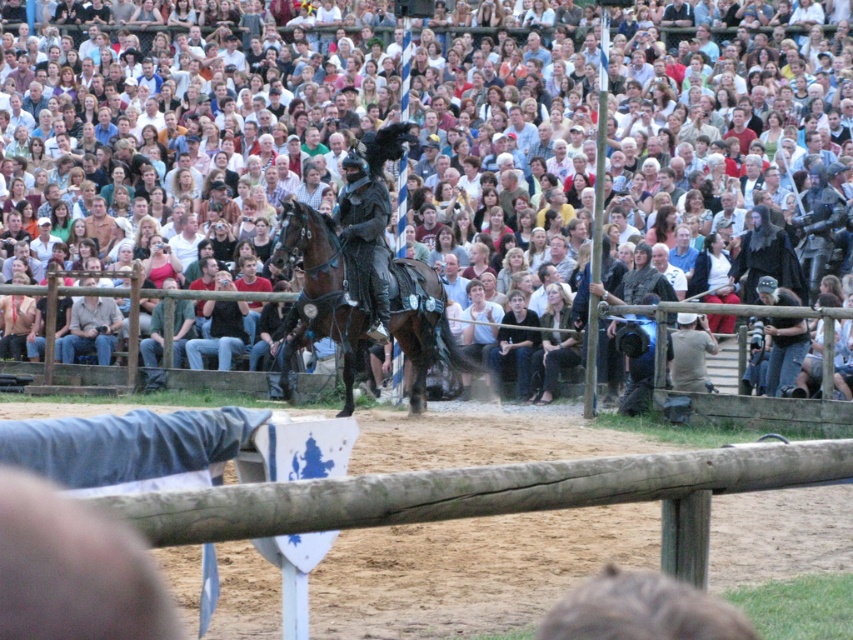
Question: Where is dark gray fabric at lower center located in relation to dark blue jeans at lower center in the image?

Choices:
 (A) left
 (B) right

Answer: (B)

Question: Which point is closer to the camera taking this photo?

Choices:
 (A) (519, 394)
 (B) (554, 340)

Answer: (A)

Question: Estimate the real-world distances between objects in this image. Which object is closer to the wooden at center?

Choices:
 (A) shiny brown horse at center
 (B) dark gray fabric at lower center

Answer: (B)

Question: Is dark gray fabric at lower center below dark blue jeans at lower center?

Choices:
 (A) no
 (B) yes

Answer: (B)

Question: Which is nearer to the wooden at center?

Choices:
 (A) white cotton shirt at center
 (B) dark blue jeans at lower center
 (C) shiny brown horse at center
 (D) dark gray fabric at lower center

Answer: (D)

Question: Is white cotton shirt at center wider than wooden at center?

Choices:
 (A) no
 (B) yes

Answer: (B)